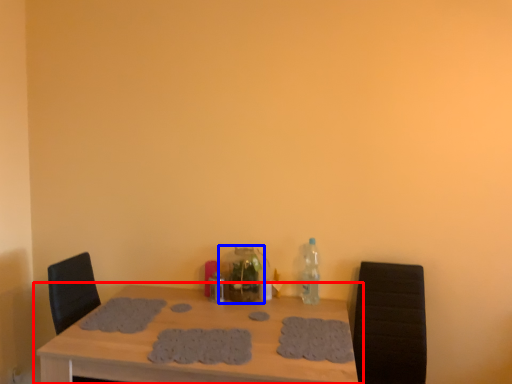
Question: Which object appears closest to the camera in this image, table (highlighted by a red box) or bottle (highlighted by a blue box)?

Choices:
 (A) table
 (B) bottle

Answer: (A)